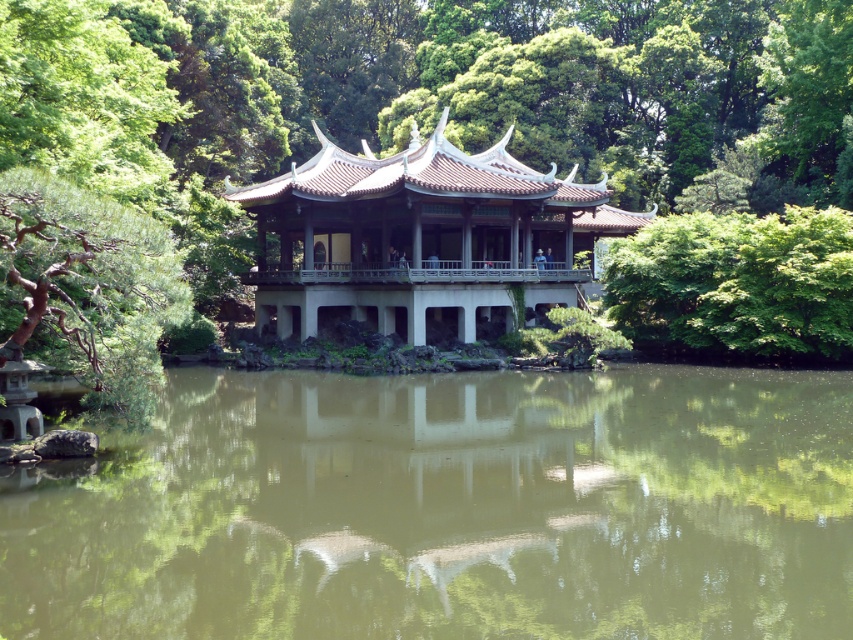
You are standing in the serene scene and want to take a photo of both the green leafy tree at center and the matte gray gazebo at center. Which object should you focus on first to ensure both are in clear view?

The green leafy tree at center is closer to the viewer than the matte gray gazebo at center, so you should focus on the green leafy tree at center first to ensure both are in clear view.

You are a visitor at the pavilion and want to know if the green reflective water at center can fit entirely within the space occupied by the green leafy tree at center. Based on the scene description, can it?

The green reflective water at center has a width that is less than the green leafy tree at center, so yes, the green reflective water at center can fit entirely within the space occupied by the green leafy tree at center.

You are standing at the edge of the pond and want to place a small decorative boat in the water. The boat requires at least 40 feet of space to navigate safely. Can the green reflective water at center accommodate the boat?

The green reflective water at center is 44.65 feet away from the viewer, so yes, it can accommodate the boat since the distance is sufficient for safe navigation.